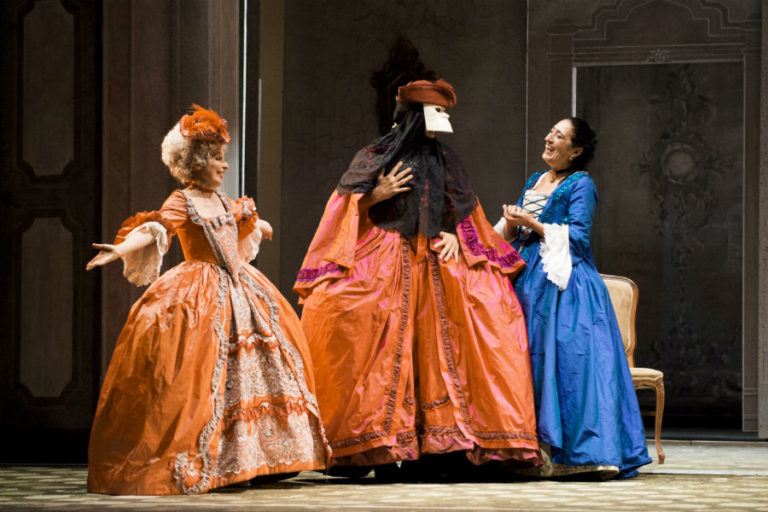
At what (x,y) coordinates should I click in order to perform the action: click on chair. Please return your answer as a coordinate pair (x, y). The height and width of the screenshot is (512, 768). Looking at the image, I should click on (613, 302).